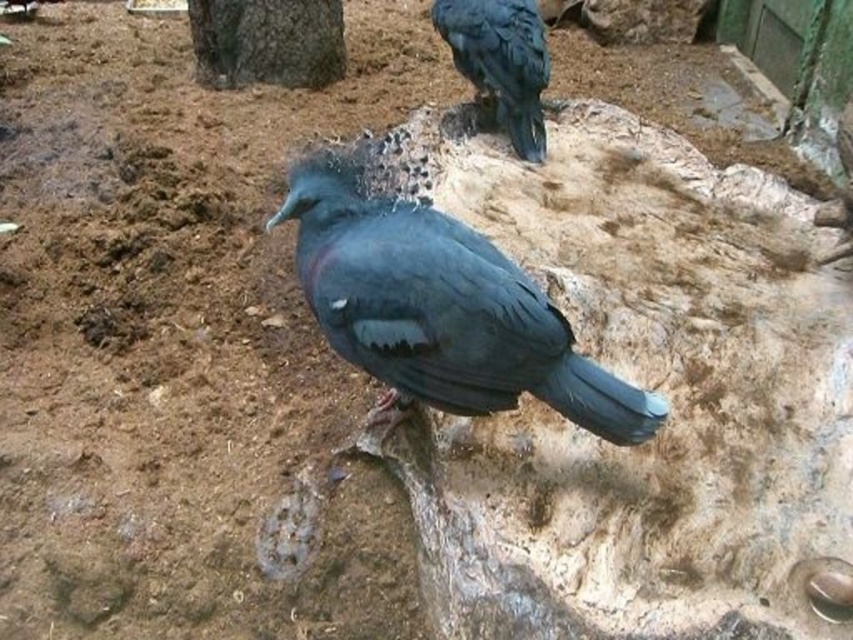
You are a zookeeper observing the birds in the enclosure. You notice a point marked at coordinates (440, 308). Which bird is located at that point?

The shiny blue bird at center is located at point (440, 308).

You are a zookeeper observing the birds in the enclosure. You notice the shiny blue bird at center and the shiny black bird at upper right. Which bird is positioned lower in the image?

The shiny blue bird at center is positioned below the shiny black bird at upper right, so it is lower in the image.